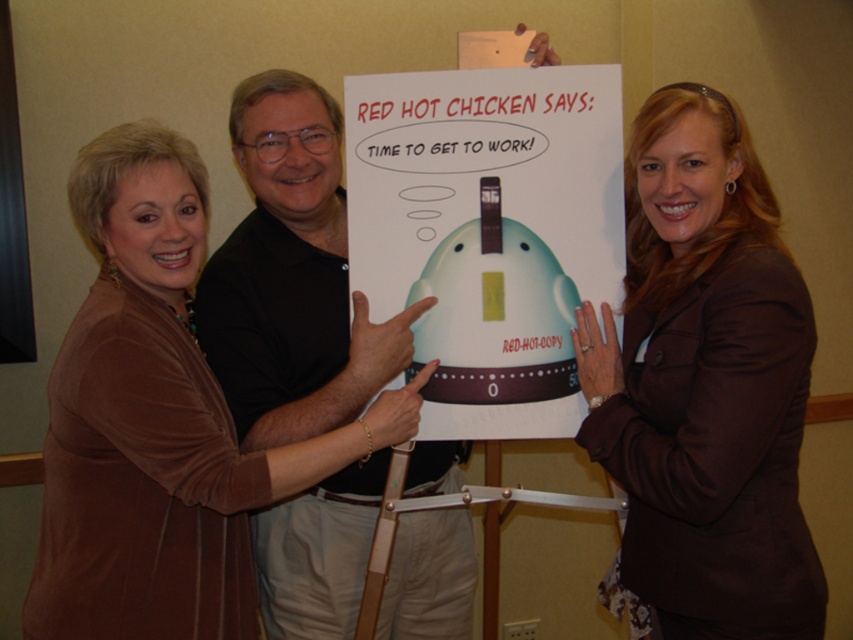
Is brown velvety sweater at upper left below white paperboard at center?

Correct, brown velvety sweater at upper left is located below white paperboard at center.

From the picture: Does brown velvety sweater at upper left appear on the left side of white paperboard at center?

Yes, brown velvety sweater at upper left is to the left of white paperboard at center.

Who is more distant from viewer, (82, 161) or (519, 112)?

Point (519, 112)

Identify the location of brown velvety sweater at upper left. (157, 422).

This screenshot has width=853, height=640. Identify the location of brown fabric jacket at upper right. (706, 384).

Which is below, brown fabric jacket at upper right or brown velvety sweater at upper left?

brown velvety sweater at upper left

The image size is (853, 640). Describe the element at coordinates (706, 384) in the screenshot. I see `brown fabric jacket at upper right` at that location.

You are a GUI agent. You are given a task and a screenshot of the screen. Output one action in this format:
    pyautogui.click(x=<x>, y=<y>)
    Task: Click on the brown fabric jacket at upper right
    The image size is (853, 640).
    Given the screenshot: What is the action you would take?
    pyautogui.click(x=706, y=384)

Is brown fabric jacket at upper right taller than white paperboard at center?

Yes.

Locate an element on the screen. Image resolution: width=853 pixels, height=640 pixels. brown fabric jacket at upper right is located at coordinates (706, 384).